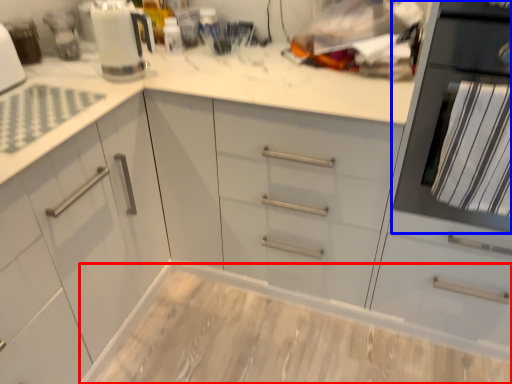
Question: Which object appears farthest to the camera in this image, counter (highlighted by a red box) or home appliance (highlighted by a blue box)?

Choices:
 (A) counter
 (B) home appliance

Answer: (A)